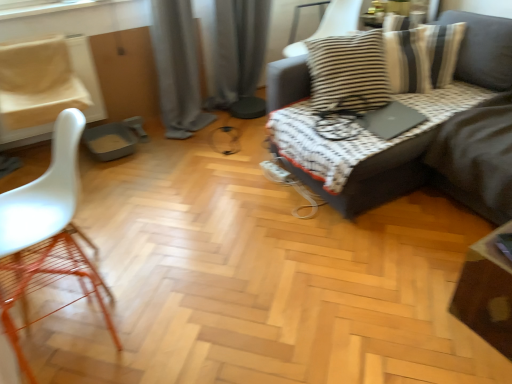
Find the location of `blank area beneath gray fabric curtain at center, the first curtain when ordered from left to right (from a real-world perspective)`. blank area beneath gray fabric curtain at center, the first curtain when ordered from left to right (from a real-world perspective) is located at coordinates (170, 136).